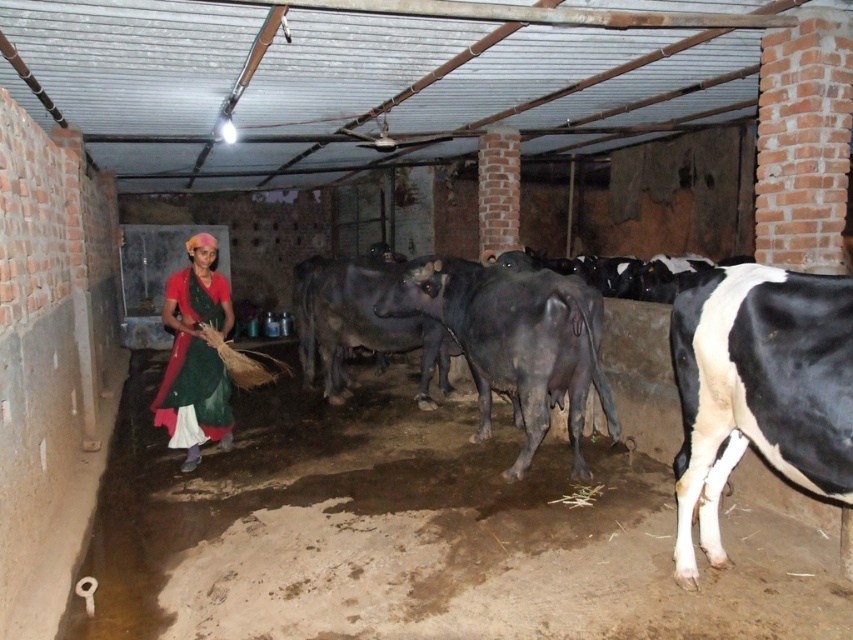
Who is more forward, (573,403) or (194,253)?

Point (573,403) is more forward.

Is point (567, 349) positioned in front of point (206, 394)?

Yes, it is in front of point (206, 394).

Is point (483, 374) closer to camera compared to point (215, 252)?

Yes, point (483, 374) is in front of point (215, 252).

Image resolution: width=853 pixels, height=640 pixels. I want to click on shiny black cow at center, so click(x=514, y=342).